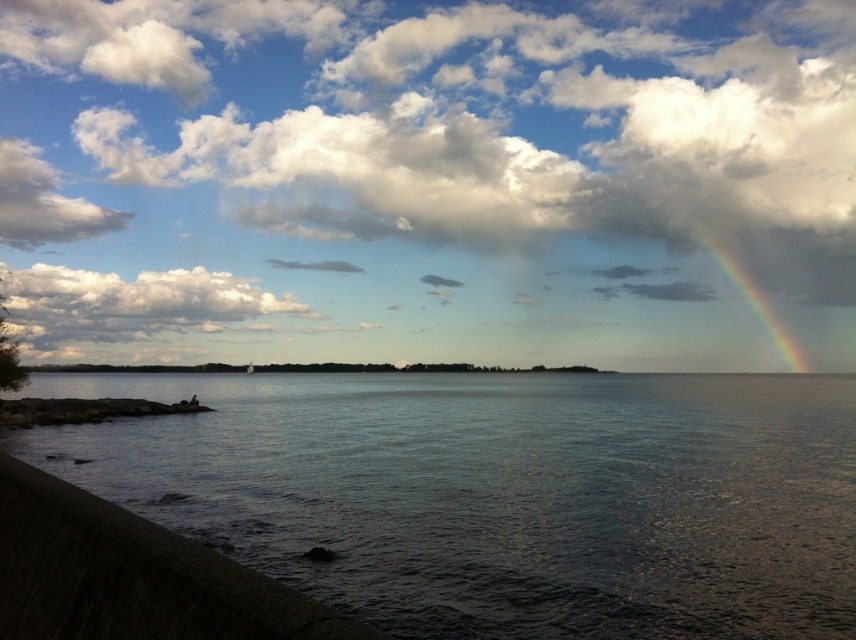
Question: Does dark concrete wall at lower left appear under white fluffy cloud at upper left?

Choices:
 (A) yes
 (B) no

Answer: (A)

Question: Is white fluffy cloud at upper center thinner than white fluffy cloud at upper left?

Choices:
 (A) no
 (B) yes

Answer: (A)

Question: Which point is farther to the camera?

Choices:
 (A) white fluffy cloud at upper left
 (B) white fluffy cloud at upper center
 (C) dark concrete wall at lower left

Answer: (B)

Question: Which point is farther to the camera?

Choices:
 (A) (203, 310)
 (B) (411, 196)
 (C) (746, 288)

Answer: (C)

Question: Which of the following is the farthest from the observer?

Choices:
 (A) white fluffy cloud at upper center
 (B) dark concrete wall at lower left
 (C) rainbow at upper right
 (D) dark gray water at lower left

Answer: (C)

Question: Is dark gray water at lower left thinner than rainbow at upper right?

Choices:
 (A) no
 (B) yes

Answer: (A)